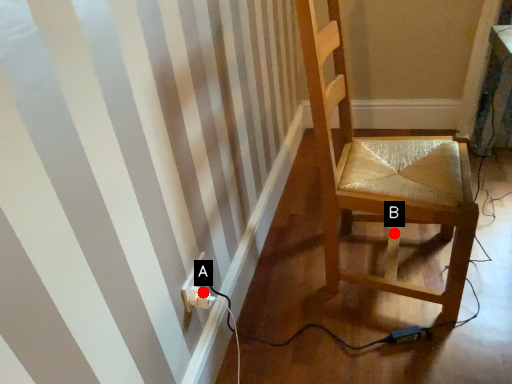
Question: Two points are circled on the image, labeled by A and B beside each circle. Among these points, which one is farthest from the camera?

Choices:
 (A) A is further
 (B) B is further

Answer: (B)